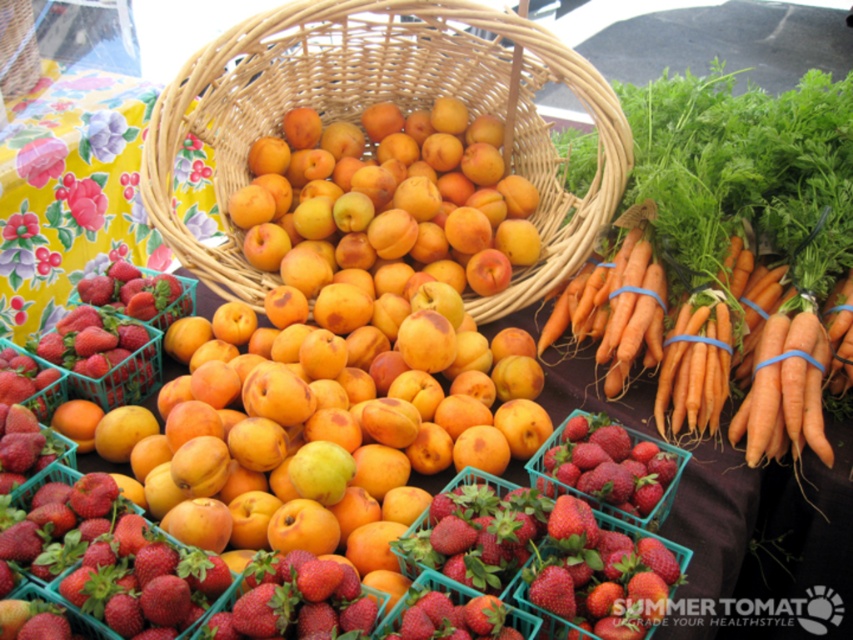
You are standing at the farmer market and want to pick up the strawberries. The strawberries are in the small green plastic baskets on the left side of the image. There is a point at coordinates point (670, 346) that is 1.40 meters away from you. If you extend your hand to reach that point, will you be able to reach the strawberries?

The strawberries are located on the left side of the image, and the point at coordinates point (670, 346) is 1.40 meters away from you. Since the strawberries are in the small green plastic baskets on the left side, you would need to check if the point corresponds to their location. However, without knowing the exact position of the strawberries relative to the point, it is uncertain if extending your hand to that point would allow you to reach them.